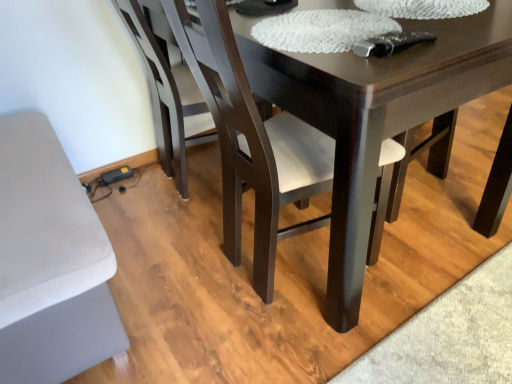
Identify the location of vacant area to the left of dark wood chair at center, positioned as the second chair in back-to-front order. (165, 272).